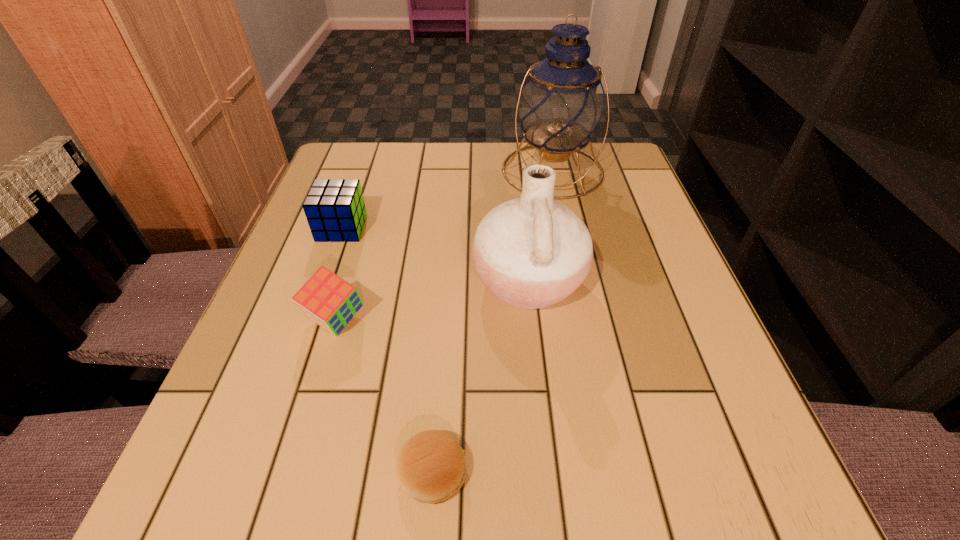
Identify the location of free space at the right edge. This screenshot has height=540, width=960. 629,286.

This screenshot has height=540, width=960. Identify the location of vacant space at the far right corner. (603, 191).

Identify the location of vacant space at the near right corner of the desktop. The width and height of the screenshot is (960, 540). (717, 489).

What are the coordinates of `vacant space that's between the second tallest object and the farther cube` in the screenshot? It's located at (435, 255).

Locate an element on the screen. The width and height of the screenshot is (960, 540). vacant area between the nearer cube and the pottery is located at coordinates (432, 301).

Locate an element on the screen. The width and height of the screenshot is (960, 540). free space between the lantern and the fourth nearest object is located at coordinates (447, 199).

Identify the location of vacant space that is in between the pottery and the second farthest object. (435, 255).

Find the location of a particular element. Image resolution: width=960 pixels, height=540 pixels. empty location between the pottery and the farther cube is located at coordinates (435, 255).

You are a GUI agent. You are given a task and a screenshot of the screen. Output one action in this format:
    pyautogui.click(x=<x>, y=<y>)
    Task: Click on the unoccupied area between the farther cube and the pottery
    This screenshot has height=540, width=960.
    Given the screenshot: What is the action you would take?
    pyautogui.click(x=435, y=255)

Locate an element on the screen. The width and height of the screenshot is (960, 540). vacant region between the lantern and the nearer cube is located at coordinates (444, 246).